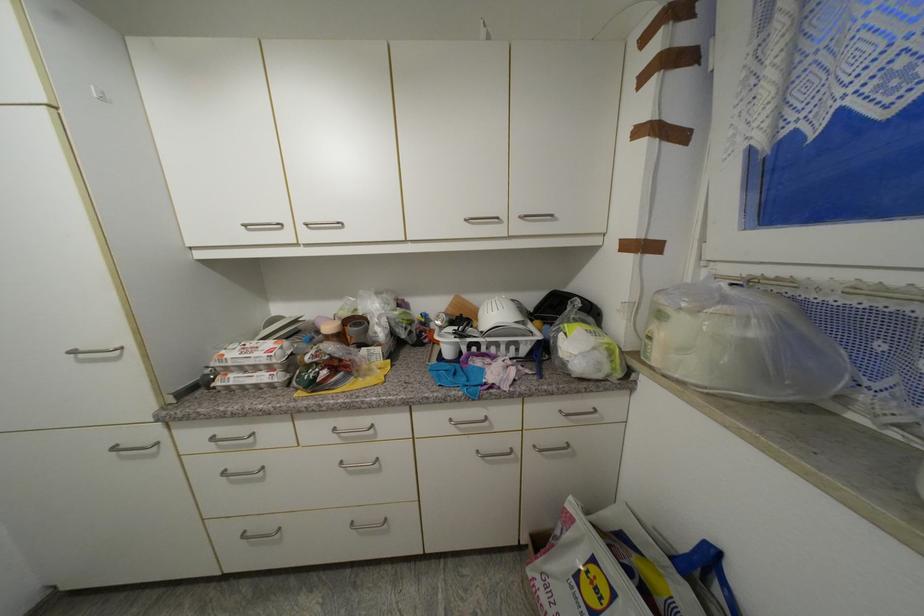
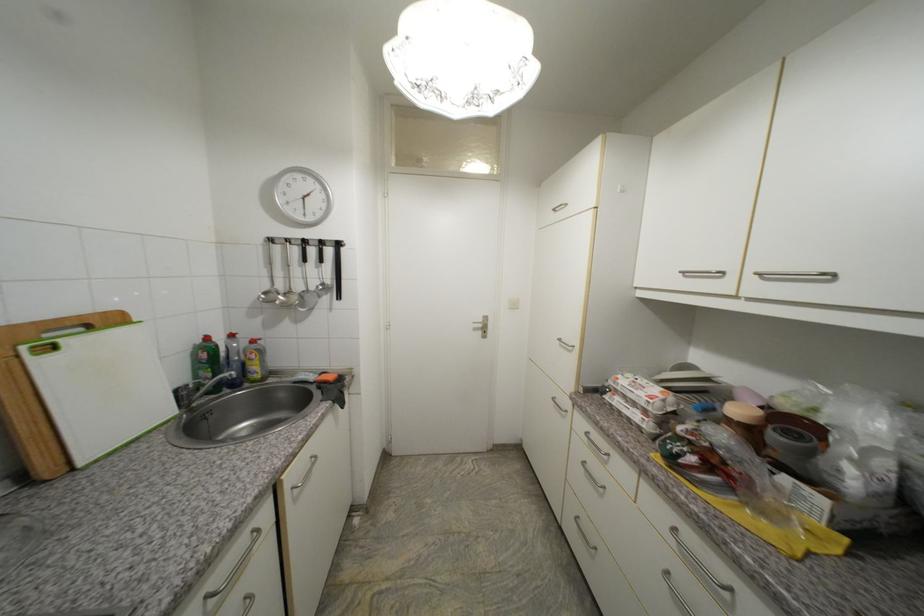
The point at (x=284, y=225) is marked in the first image. Where is the corresponding point in the second image?

(724, 274)